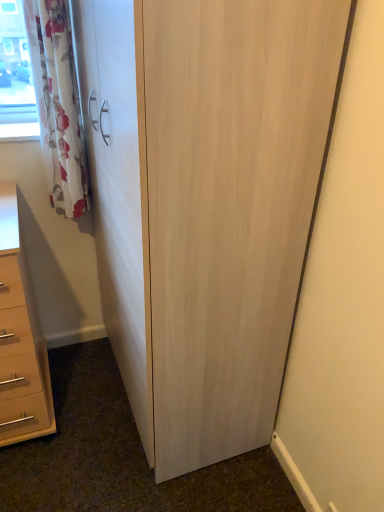
What are the coordinates of `free point to the left of light wood cupboard at center` in the screenshot? It's located at [x=77, y=400].